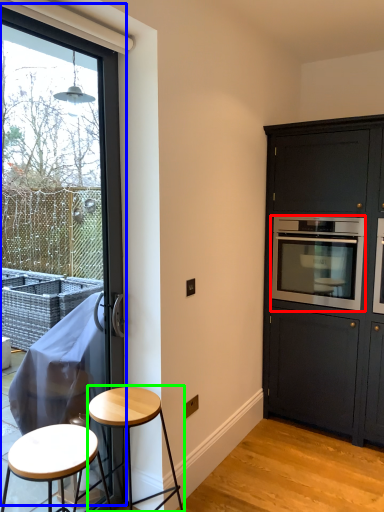
Question: Considering the real-world distances, which object is farthest from oven (highlighted by a red box)? window (highlighted by a blue box) or stool (highlighted by a green box)?

Choices:
 (A) window
 (B) stool

Answer: (B)